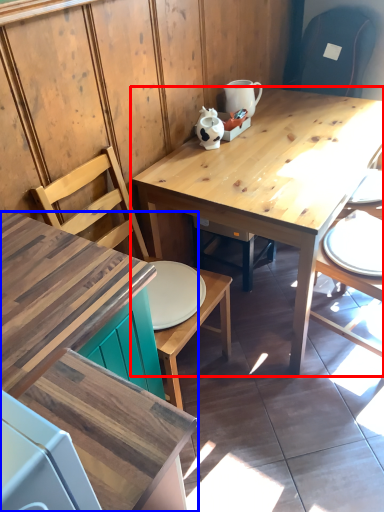
Question: Which point is further to the camera, table (highlighted by a red box) or desk (highlighted by a blue box)?

Choices:
 (A) table
 (B) desk

Answer: (A)